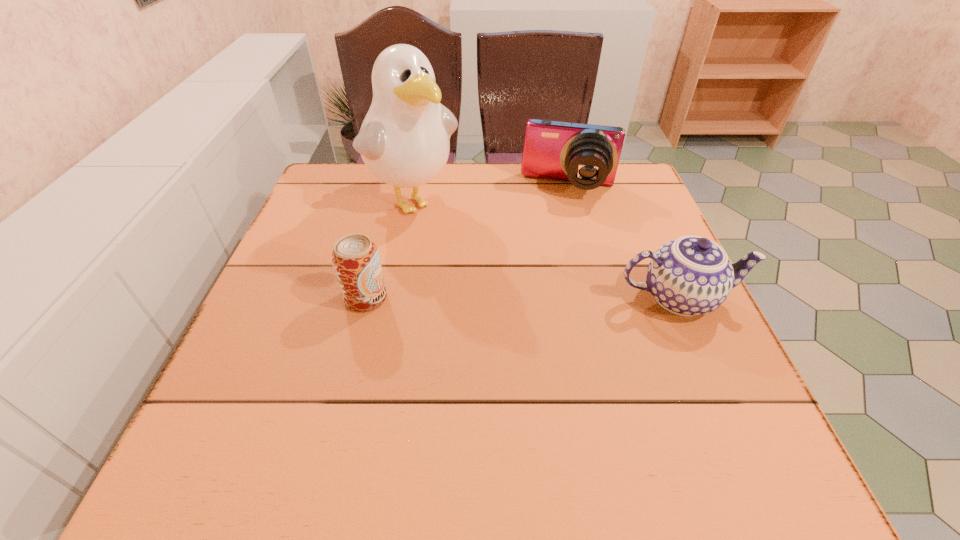
Locate an element on the screen. beer can is located at coordinates 355,258.

This screenshot has height=540, width=960. I want to click on chinaware, so click(x=691, y=275).

Where is `gull`? The width and height of the screenshot is (960, 540). gull is located at coordinates (404, 140).

Where is `camera`? The height and width of the screenshot is (540, 960). camera is located at coordinates (587, 155).

You are a GUI agent. You are given a task and a screenshot of the screen. Output one action in this format:
    pyautogui.click(x=<x>, y=<y>)
    Task: Click on the vacant space located on the front of the beer can
    This screenshot has width=960, height=540.
    Given the screenshot: What is the action you would take?
    pyautogui.click(x=334, y=422)

The width and height of the screenshot is (960, 540). Identify the location of vacant space situated on the beak of the gull. (510, 295).

In order to click on free space located on the beak of the gull in this screenshot , I will do `click(449, 238)`.

Locate an element on the screen. This screenshot has height=540, width=960. vacant point located 0.360m on the beak of the gull is located at coordinates (532, 316).

Locate an element on the screen. Image resolution: width=960 pixels, height=540 pixels. vacant space positioned on the front-facing side of the camera is located at coordinates (557, 235).

Where is `free space located 0.180m on the front-facing side of the camera`? Image resolution: width=960 pixels, height=540 pixels. free space located 0.180m on the front-facing side of the camera is located at coordinates (555, 249).